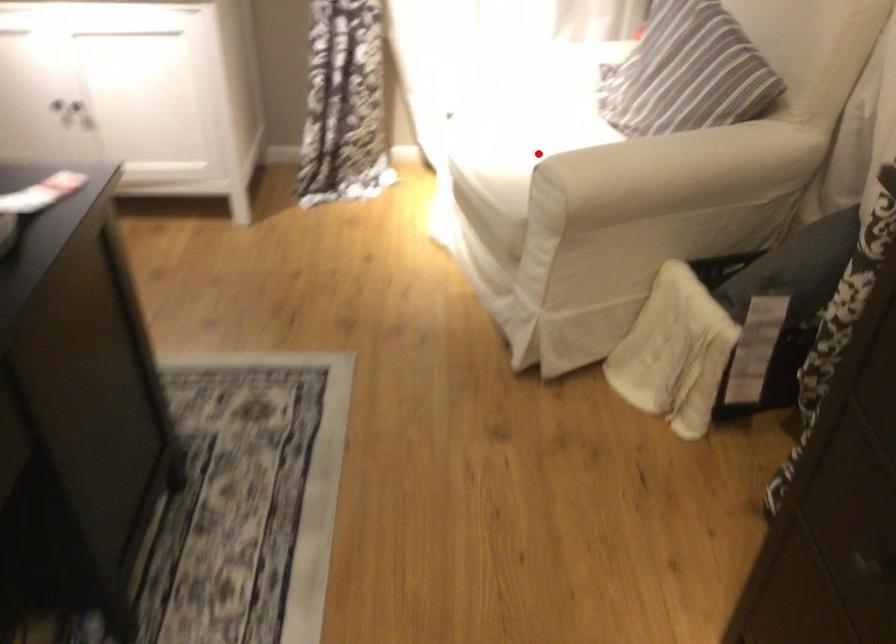
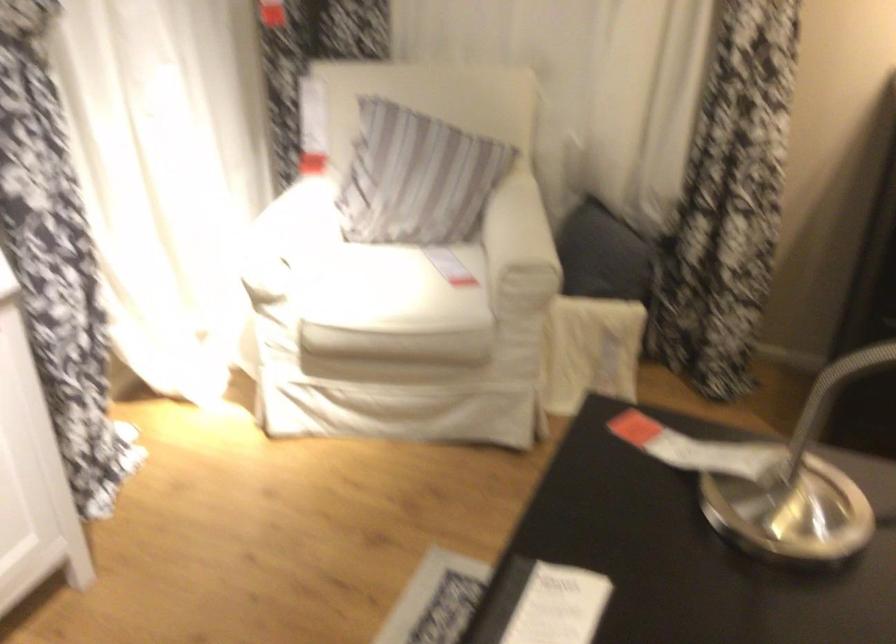
The point at the highlighted location is marked in the first image. Where is the corresponding point in the second image?

(388, 287)